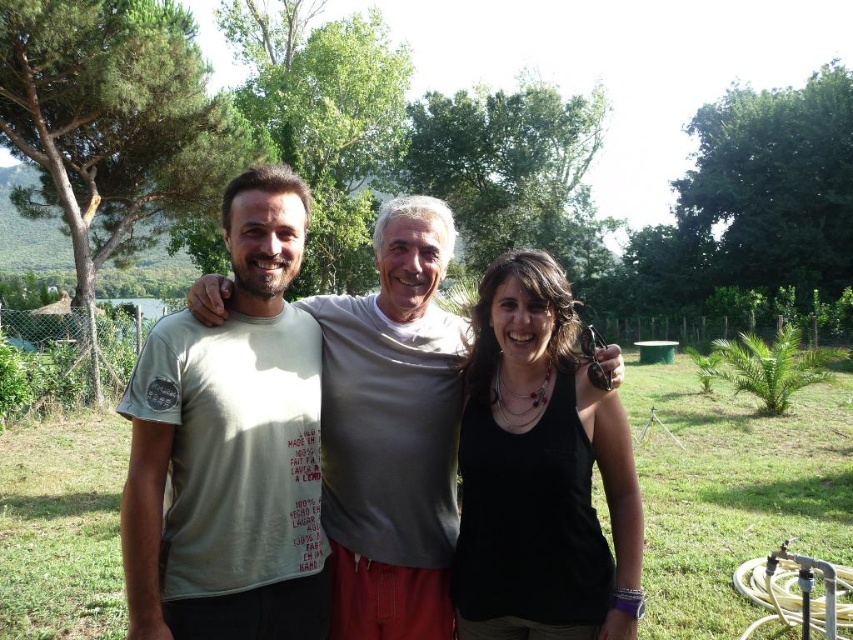
Question: In this image, where is light olive-green t-shirt at center located relative to green leafy tree at upper center?

Choices:
 (A) above
 (B) below

Answer: (B)

Question: Which point is closer to the camera taking this photo?

Choices:
 (A) (228, 28)
 (B) (123, 224)

Answer: (B)

Question: Can you confirm if light olive-green t-shirt at center is positioned to the right of green leafy tree at upper center?

Choices:
 (A) no
 (B) yes

Answer: (A)

Question: Is matte gray t-shirt at center smaller than light olive-green t-shirt at center?

Choices:
 (A) yes
 (B) no

Answer: (B)

Question: Based on their relative distances, which object is farther from the green leafy tree at center?

Choices:
 (A) matte gray t-shirt at center
 (B) green leafy tree at upper center

Answer: (A)

Question: Which of the following is the closest to the observer?

Choices:
 (A) (364, 264)
 (B) (242, 282)
 (C) (579, 404)
 (D) (245, 310)

Answer: (B)